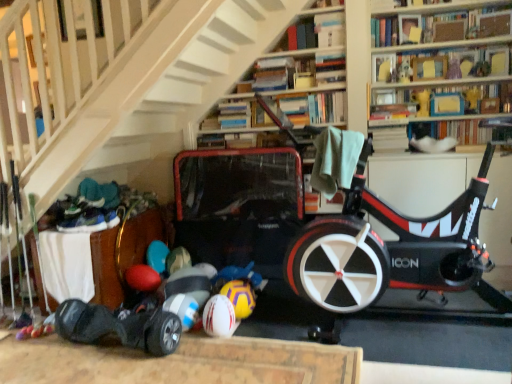
This screenshot has height=384, width=512. Identify the location of free space that is to the left of white matte rugby ball at lower center. (190, 340).